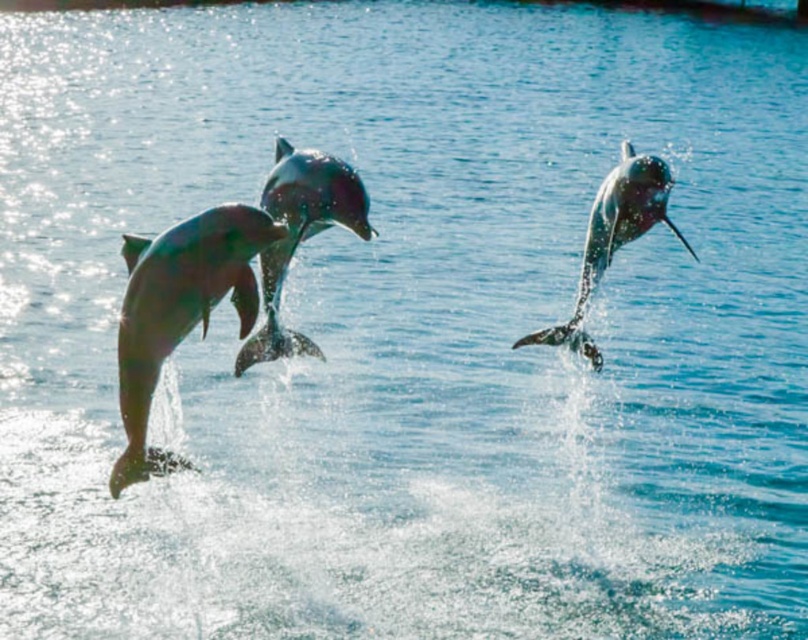
Question: Which of the following is the farthest from the observer?

Choices:
 (A) (596, 358)
 (B) (150, 369)

Answer: (A)

Question: In this image, where is shiny metallic dolphin at left located relative to shiny silver dolphin at center?

Choices:
 (A) above
 (B) below

Answer: (B)

Question: Is shiny metallic dolphin at left thinner than shiny silver dolphin at center?

Choices:
 (A) yes
 (B) no

Answer: (B)

Question: Does shiny metallic dolphin at left have a smaller size compared to shiny silver dolphin at center?

Choices:
 (A) yes
 (B) no

Answer: (A)

Question: Which point appears closest to the camera in this image?

Choices:
 (A) (285, 141)
 (B) (202, 321)
 (C) (628, 148)

Answer: (B)

Question: Estimate the real-world distances between objects in this image. Which object is farther from the shiny silver dolphin at upper right?

Choices:
 (A) shiny metallic dolphin at left
 (B) shiny silver dolphin at center

Answer: (A)